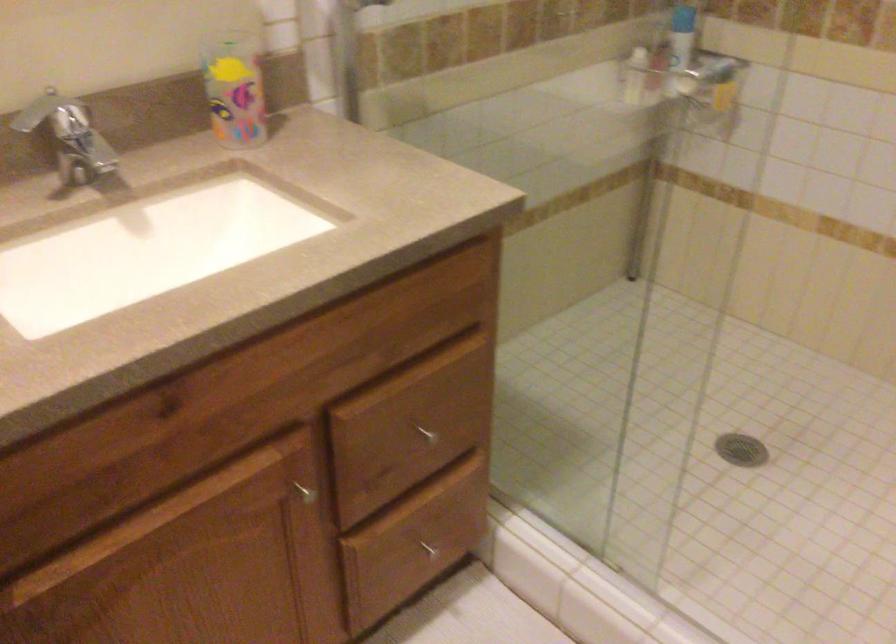
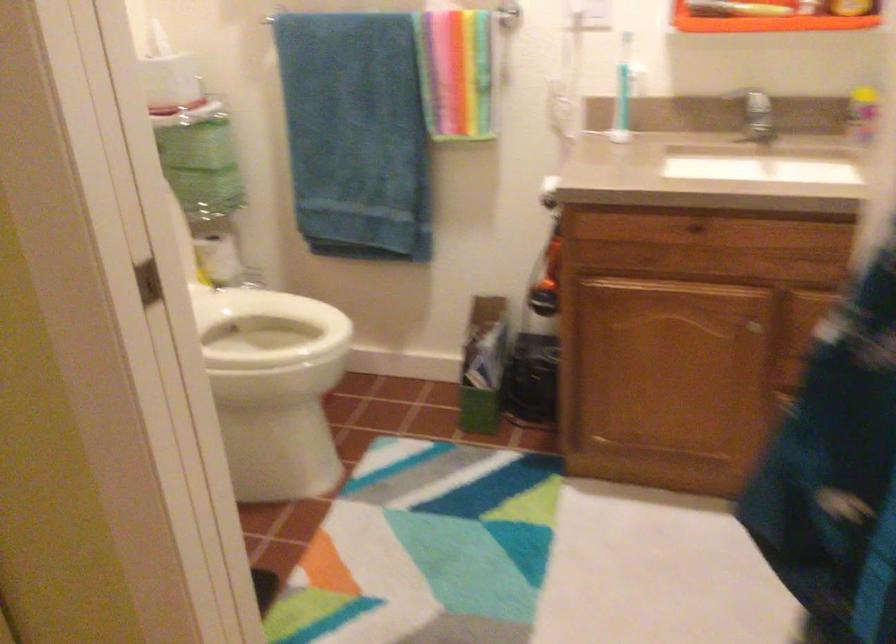
In the second image, find the point that corresponds to [149,422] in the first image.

(692, 229)